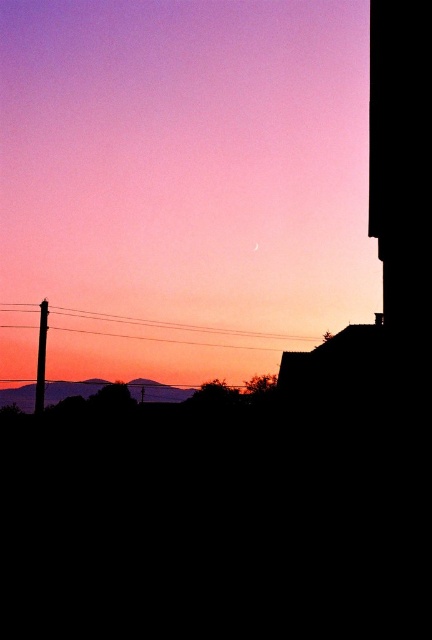
You are standing in the sunset scene and want to walk from the point at coordinates point (82, 314) to the point at coordinates point (41, 385). Which direction should you face to move towards the closer point?

You should face towards the point at coordinates point (41, 385) because it is closer to you than the point at coordinates point (82, 314).

You are an astronomer analyzing the sunset scene. You notice a point labeled at coordinates (181, 184). Based on the scene description, what celestial object is marked at this location?

The point at coordinates (181, 184) marks the silvery metallic crescent moon at upper center.

You are an architect designing a new sculpture that needs to be placed between the black wire at lower center and the silvery metallic mountains at lower center. Based on their heights, which object should the sculpture be positioned closer to for visual balance?

The sculpture should be positioned closer to the silvery metallic mountains at lower center because the black wire at lower center has a greater height, so balancing with the shorter mountains would require closer placement to compensate for the height difference.